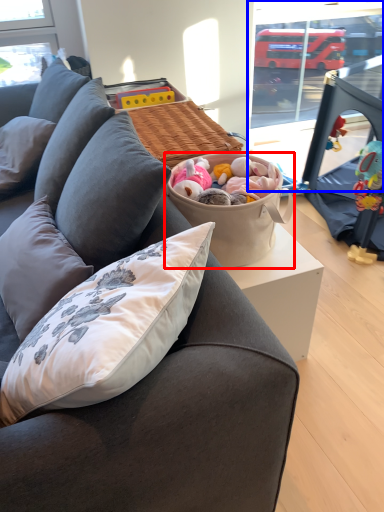
Question: Among these objects, which one is nearest to the camera, picnic basket (highlighted by a red box) or window screen (highlighted by a blue box)?

Choices:
 (A) picnic basket
 (B) window screen

Answer: (A)